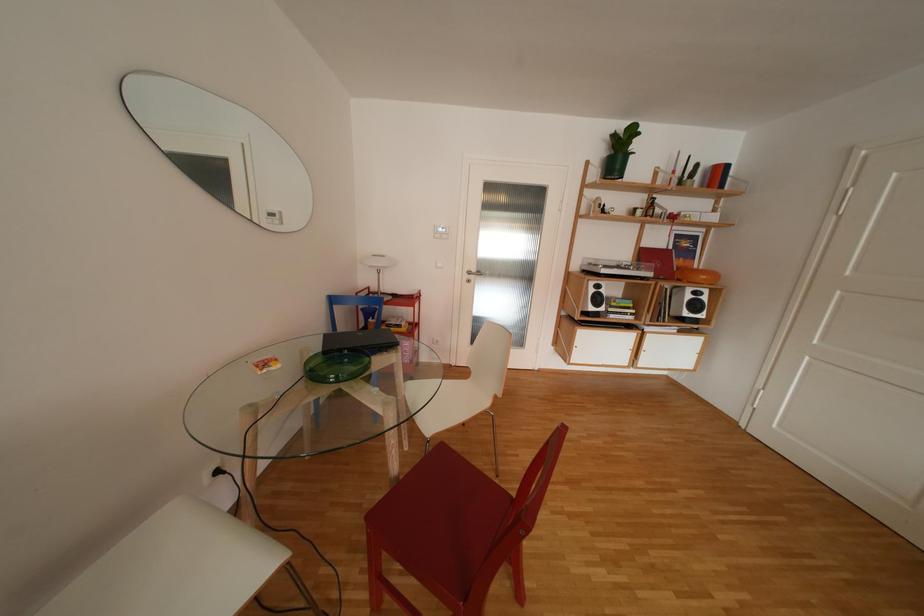
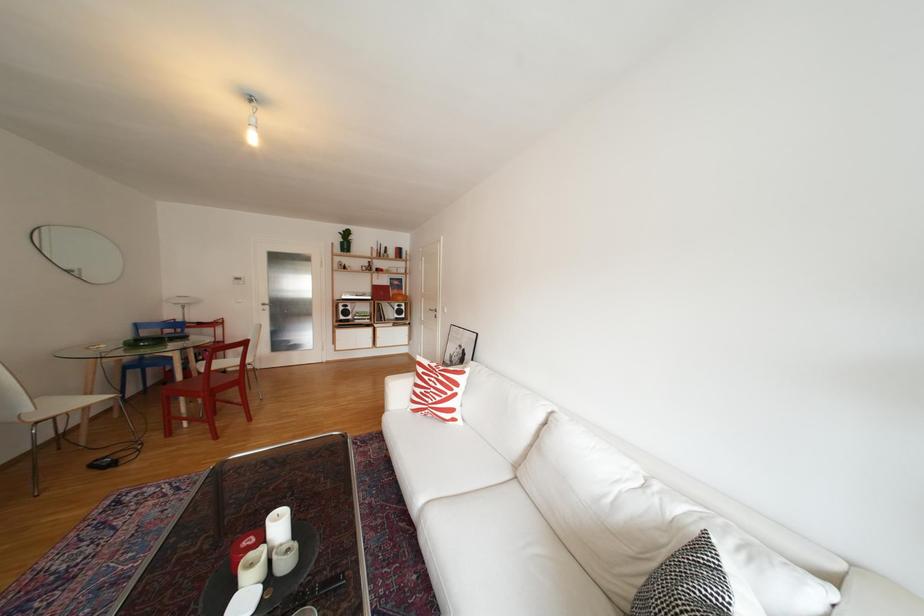
Which direction would the cameraman need to move to produce the second image?

The movement direction of the cameraman is right, backward.